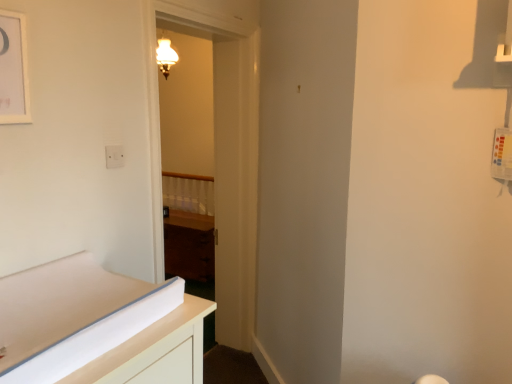
Question: From a real-world perspective, is white plastic electric outlet at upper left positioned above or below white matte picture frame at upper left?

Choices:
 (A) below
 (B) above

Answer: (A)

Question: Is white plastic electric outlet at upper left to the left or to the right of white matte picture frame at upper left in the image?

Choices:
 (A) right
 (B) left

Answer: (A)

Question: Estimate the real-world distances between objects in this image. Which object is closer to the white plastic electric outlet at upper left?

Choices:
 (A) matte brass sconce at upper center
 (B) wooden door at center
 (C) white glossy changing table at lower left
 (D) dark wood cabinet at center
 (E) wooden at center

Answer: (C)

Question: Which object is positioned closest to the white matte picture frame at upper left?

Choices:
 (A) wooden door at center
 (B) white plastic electric outlet at upper left
 (C) dark wood cabinet at center
 (D) wooden at center
 (E) white glossy changing table at lower left

Answer: (B)